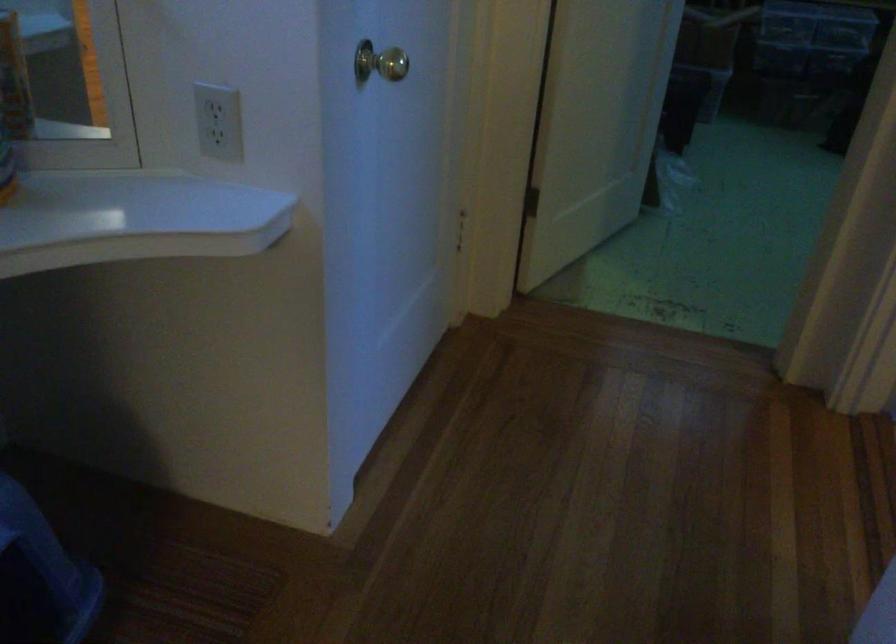
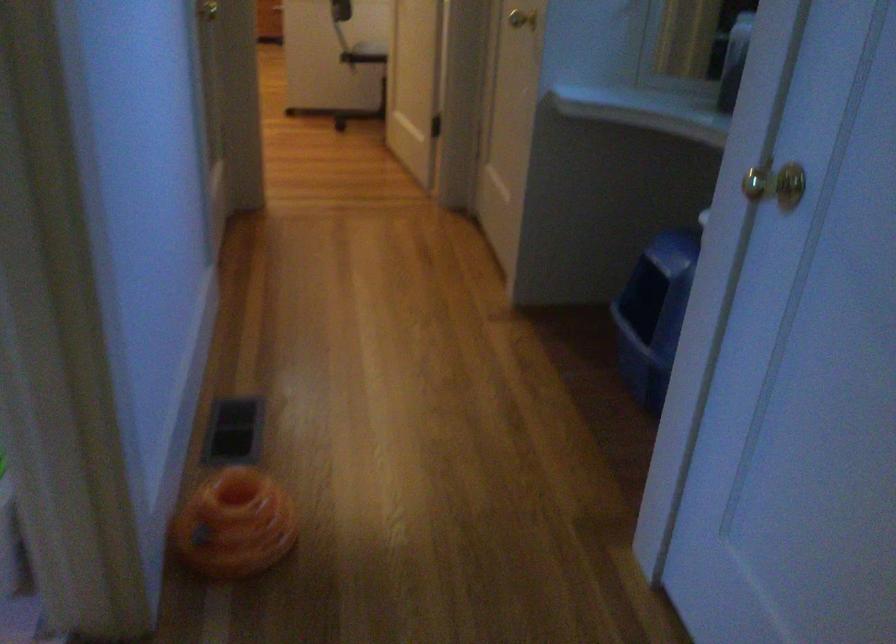
Locate, in the second image, the point that corresponds to [365,80] in the first image.

(776, 184)